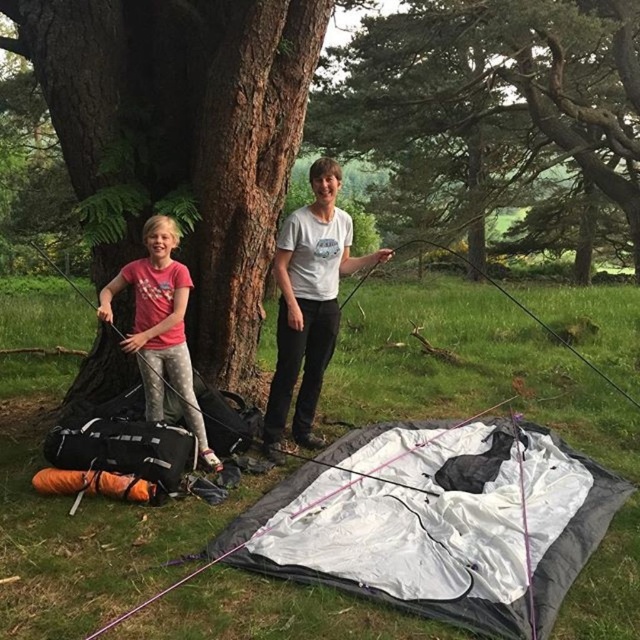
Does green textured tree at center lie behind white fabric tent at lower center?

Yes, it is.

Who is more distant from viewer, [378,104] or [92,634]?

The point [378,104] is more distant.

You are a GUI agent. You are given a task and a screenshot of the screen. Output one action in this format:
    pyautogui.click(x=<x>, y=<y>)
    Task: Click on the green textured tree at center
    
    Given the screenshot: What is the action you would take?
    pyautogui.click(x=492, y=86)

Can you confirm if white cotton t-shirt at center is taller than pink fabric shirt at left?

Correct, white cotton t-shirt at center is much taller as pink fabric shirt at left.

Who is higher up, white cotton t-shirt at center or pink fabric shirt at left?

white cotton t-shirt at center is above.

Who is more forward, [282,317] or [161,419]?

Point [161,419] is in front.

Where is `white cotton t-shirt at center`? The width and height of the screenshot is (640, 640). white cotton t-shirt at center is located at coordinates 308,304.

Does point (122, 250) come in front of point (218, 561)?

No, it is behind (218, 561).

Who is more distant from viewer, (248, 92) or (216, 561)?

Positioned behind is point (248, 92).

Locate an element on the screen. Image resolution: width=640 pixels, height=640 pixels. brown rough tree at center is located at coordinates (182, 134).